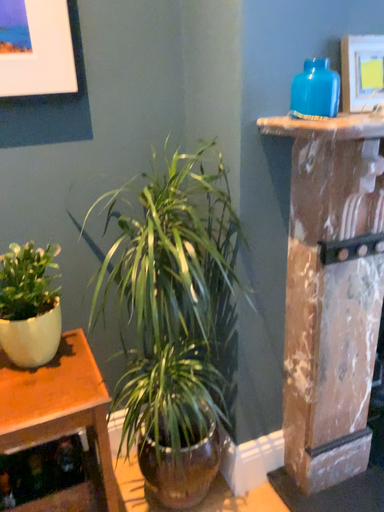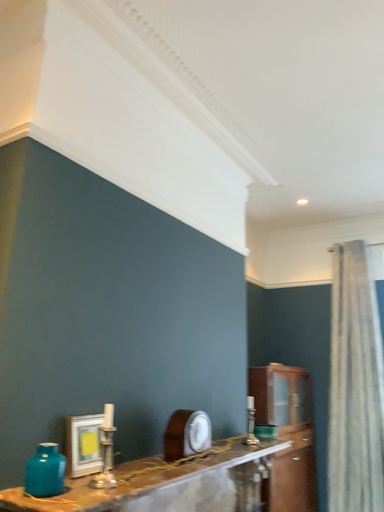
Question: Which way did the camera rotate in the video?

Choices:
 (A) rotated downward
 (B) rotated upward

Answer: (B)